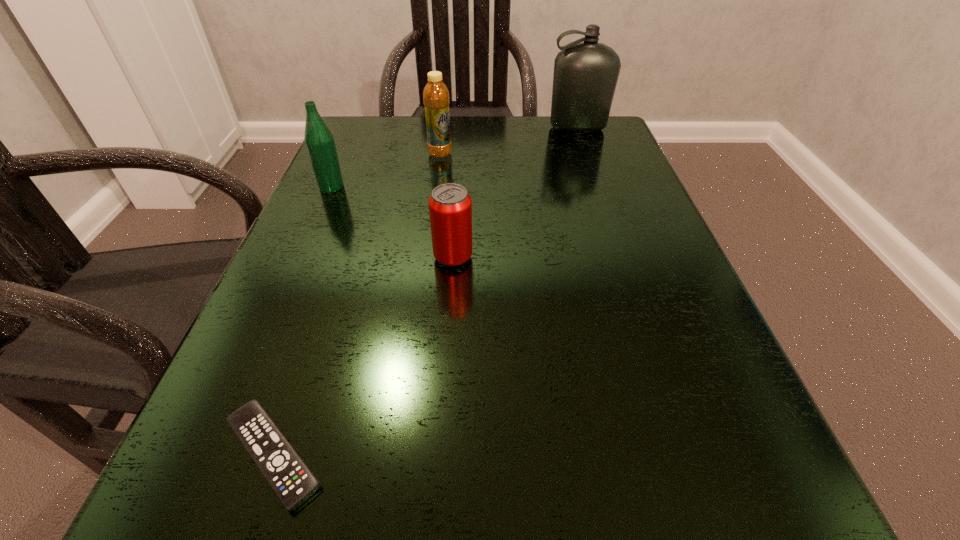
Where is `object situated at the far right corner`? object situated at the far right corner is located at coordinates (585, 76).

Identify the location of vacant space at the far edge of the desktop. (415, 133).

Find the location of a particular element. The image size is (960, 540). vacant space at the left edge of the desktop is located at coordinates (298, 327).

At what (x,y) coordinates should I click in order to perform the action: click on vacant position at the right edge of the desktop. Please return your answer as a coordinate pair (x, y). Image resolution: width=960 pixels, height=540 pixels. Looking at the image, I should click on (636, 423).

Locate an element on the screen. Image resolution: width=960 pixels, height=540 pixels. vacant space at the far left corner of the desktop is located at coordinates (345, 157).

Locate an element on the screen. The width and height of the screenshot is (960, 540). free spot at the near right corner of the desktop is located at coordinates (670, 518).

Locate an element on the screen. The width and height of the screenshot is (960, 540). free spot between the remote control and the fourth tallest object is located at coordinates (363, 356).

Where is `vacant space that is in between the second farthest bottle and the nearest bottle`? This screenshot has height=540, width=960. vacant space that is in between the second farthest bottle and the nearest bottle is located at coordinates (386, 171).

This screenshot has width=960, height=540. In order to click on blank region between the tallest object and the fourth tallest object in this screenshot , I will do `click(516, 193)`.

What are the coordinates of `free space between the farthest bottle and the nearest object` in the screenshot? It's located at (425, 291).